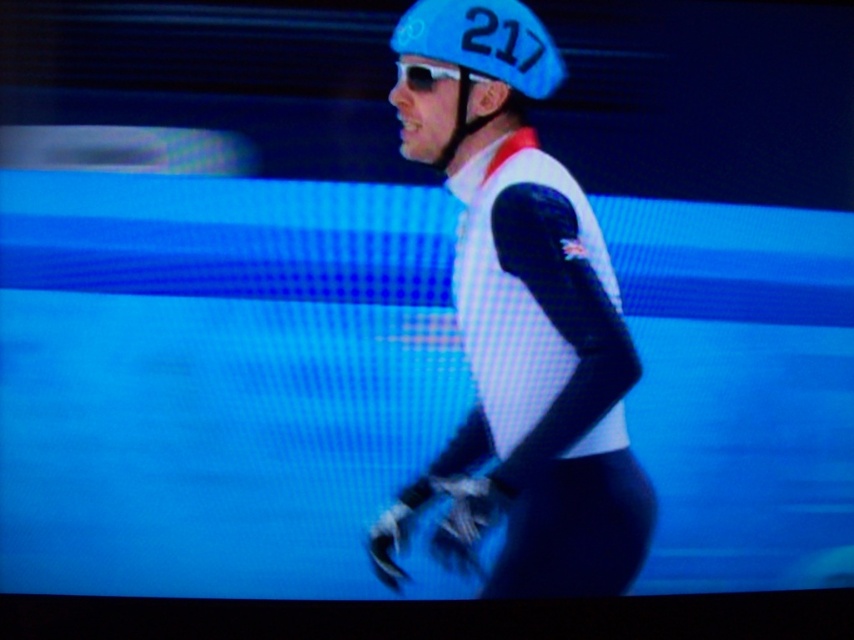
Who is positioned more to the left, blue matte helmet at upper center or sunglasses at center?

Positioned to the left is sunglasses at center.

Is blue matte helmet at upper center below sunglasses at center?

Correct, blue matte helmet at upper center is located below sunglasses at center.

This screenshot has height=640, width=854. Describe the element at coordinates (481, 51) in the screenshot. I see `blue matte helmet at upper center` at that location.

Find the location of `blue matte helmet at upper center`. blue matte helmet at upper center is located at coordinates (481, 51).

Who is higher up, matte black suit at center or blue matte helmet at upper center?

blue matte helmet at upper center is above.

Is matte black suit at center to the right of blue matte helmet at upper center from the viewer's perspective?

Yes, matte black suit at center is to the right of blue matte helmet at upper center.

What do you see at coordinates (521, 323) in the screenshot? I see `matte black suit at center` at bounding box center [521, 323].

Where is `matte black suit at center`? The image size is (854, 640). matte black suit at center is located at coordinates (521, 323).

Looking at this image, does matte black suit at center appear under sunglasses at center?

Yes, matte black suit at center is below sunglasses at center.

This screenshot has height=640, width=854. Find the location of `matte black suit at center`. matte black suit at center is located at coordinates (521, 323).